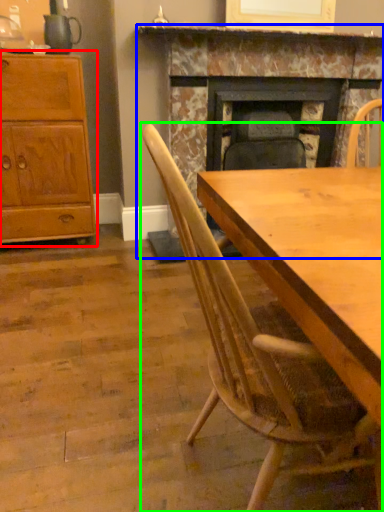
Question: Which is farther away from cabinetry (highlighted by a red box)? fireplace (highlighted by a blue box) or chair (highlighted by a green box)?

Choices:
 (A) fireplace
 (B) chair

Answer: (B)